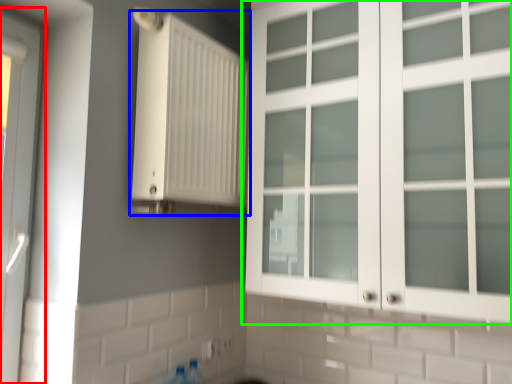
Question: Estimate the real-world distances between objects in this image. Which object is closer to door (highlighted by a red box), radiator (highlighted by a blue box) or cupboard (highlighted by a green box)?

Choices:
 (A) radiator
 (B) cupboard

Answer: (A)